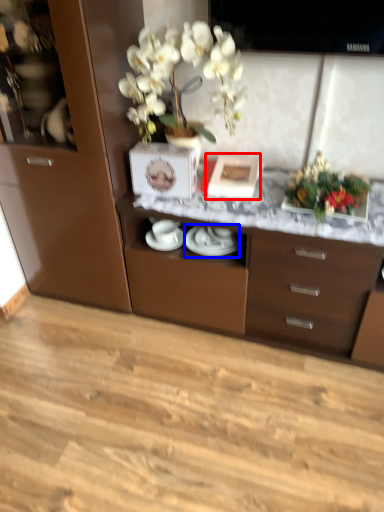
Question: Among these objects, which one is nearest to the camera, picture frame (highlighted by a red box) or tableware (highlighted by a blue box)?

Choices:
 (A) picture frame
 (B) tableware

Answer: (A)